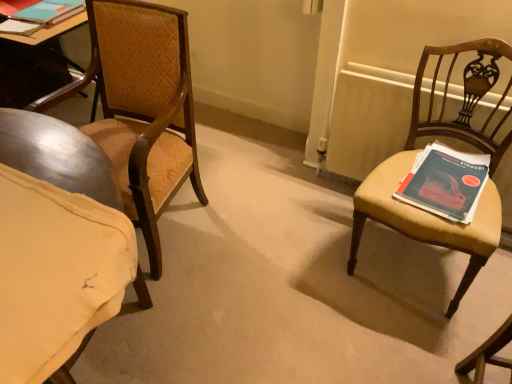
You are a GUI agent. You are given a task and a screenshot of the screen. Output one action in this format:
    pyautogui.click(x=<x>, y=<y>)
    Task: Click on the unoccupied region to the right of wooden textured chair at left, which ranks as the second chair in right-to-left order
    The width and height of the screenshot is (512, 384).
    Given the screenshot: What is the action you would take?
    pyautogui.click(x=244, y=230)